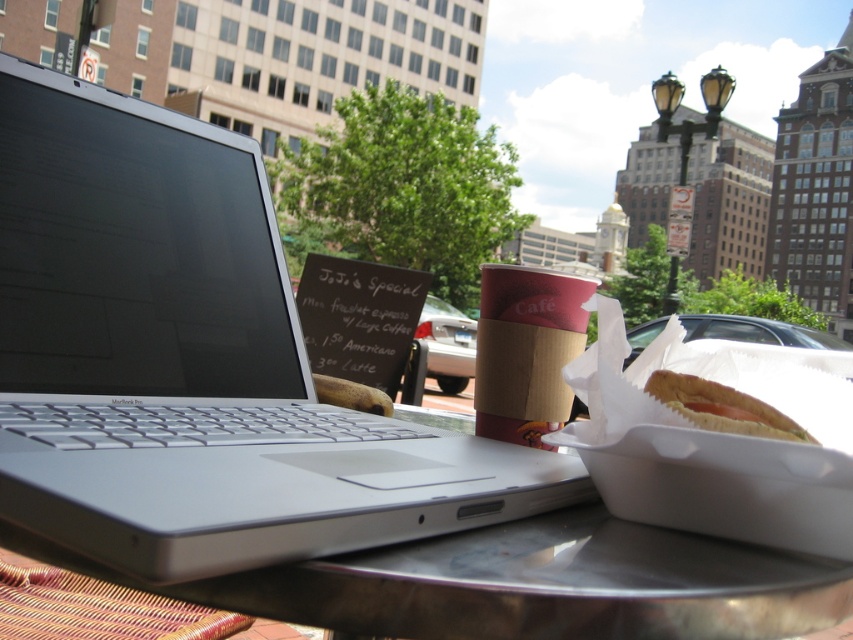
Based on the photo, who is positioned more to the left, metallic silver table at center or white paper hot dog at center?

From the viewer's perspective, metallic silver table at center appears more on the left side.

Between metallic silver table at center and white paper hot dog at center, which one has less height?

white paper hot dog at center

Measure the distance between metallic silver table at center and camera.

They are 10.55 inches apart.

The height and width of the screenshot is (640, 853). Find the location of `metallic silver table at center`. metallic silver table at center is located at coordinates (526, 584).

Can you confirm if silver metallic laptop at center is taller than metallic silver table at center?

Yes.

Measure the distance from silver metallic laptop at center to metallic silver table at center.

silver metallic laptop at center and metallic silver table at center are 6.13 inches apart.

Between point (160, 413) and point (650, 625), which one is positioned behind?

Positioned behind is point (160, 413).

Where is `silver metallic laptop at center`? The image size is (853, 640). silver metallic laptop at center is located at coordinates (190, 362).

Based on the photo, is brown paper cup at center to the left of white paper hot dog at center from the viewer's perspective?

Yes, brown paper cup at center is to the left of white paper hot dog at center.

Between point (521, 333) and point (723, 410), which one is positioned in front?

Point (723, 410) is more forward.

Locate an element on the screen. The image size is (853, 640). brown paper cup at center is located at coordinates pos(526,349).